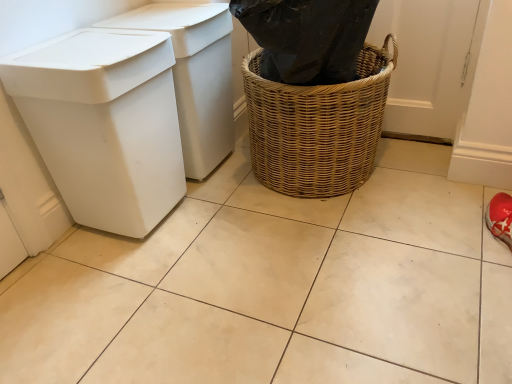
Find the location of a particular element. Image resolution: width=512 pixels, height=384 pixels. spots to the right of white plastic bin at left, which is the 2th waste container in back-to-front order is located at coordinates (224, 229).